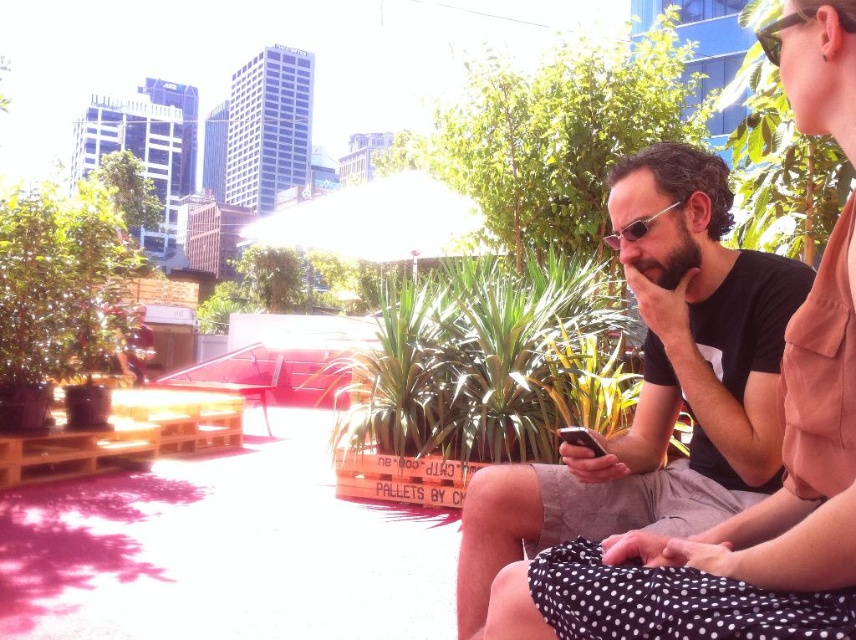
Can you confirm if black matte shirt at center is shorter than sunglasses at center?

No.

Is black matte shirt at center positioned before sunglasses at center?

That is True.

Is point (700, 168) farther from camera compared to point (633, 221)?

Yes, point (700, 168) is behind point (633, 221).

Identify the location of black matte shirt at center. This screenshot has width=856, height=640. (658, 387).

Looking at this image, can you confirm if sunglasses at upper right is positioned below sunglasses at center?

No.

Does sunglasses at upper right appear over sunglasses at center?

Correct, sunglasses at upper right is located above sunglasses at center.

Describe the element at coordinates (801, 22) in the screenshot. I see `sunglasses at upper right` at that location.

Locate an element on the screen. The height and width of the screenshot is (640, 856). sunglasses at upper right is located at coordinates (801, 22).

Which is behind, point (694, 333) or point (770, 58)?

The point (694, 333) is behind.

Who is taller, black matte shirt at center or sunglasses at upper right?

black matte shirt at center is taller.

Does point (771, 314) come closer to viewer compared to point (765, 45)?

That is False.

The height and width of the screenshot is (640, 856). Identify the location of black matte shirt at center. (658, 387).